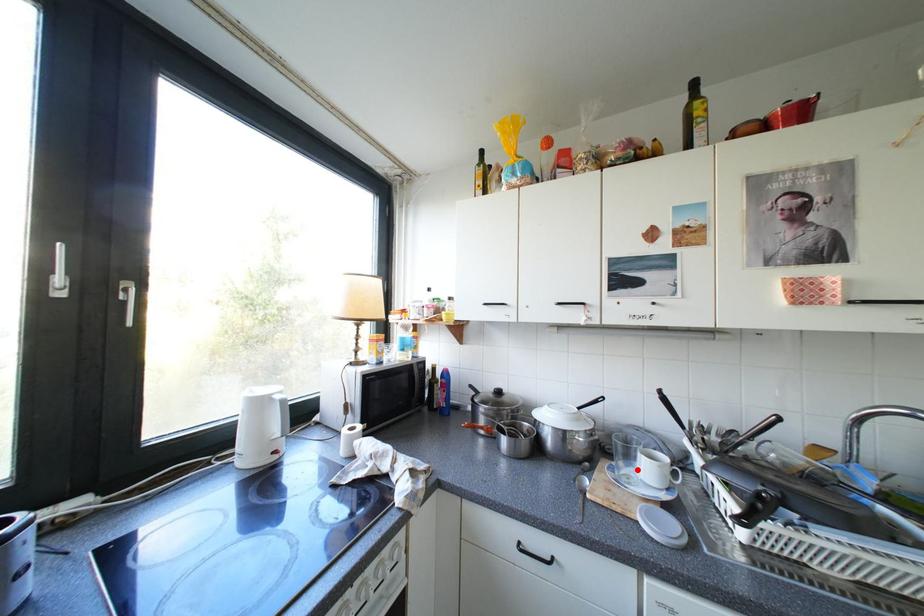
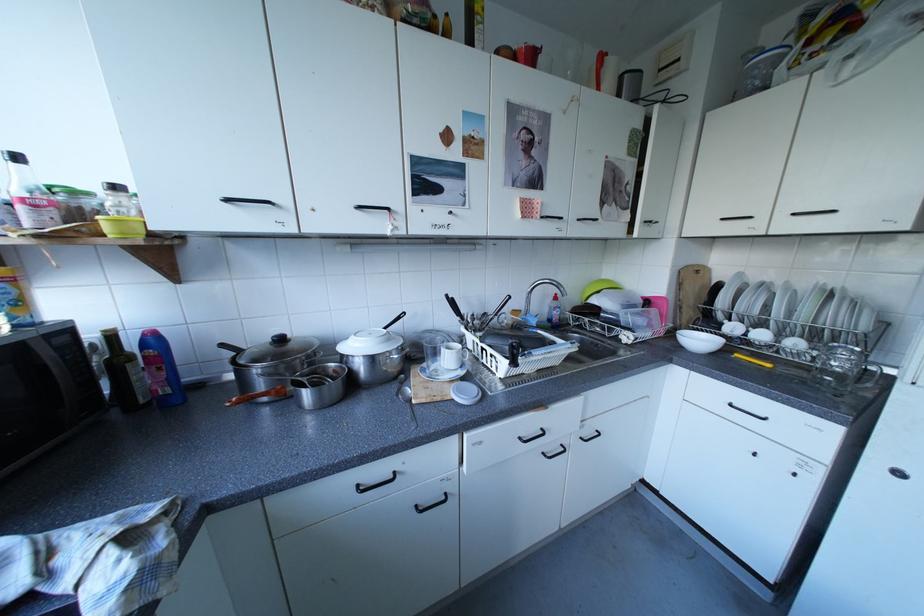
Find the pixel in the second image that matches the highlighted location in the first image.

(445, 367)